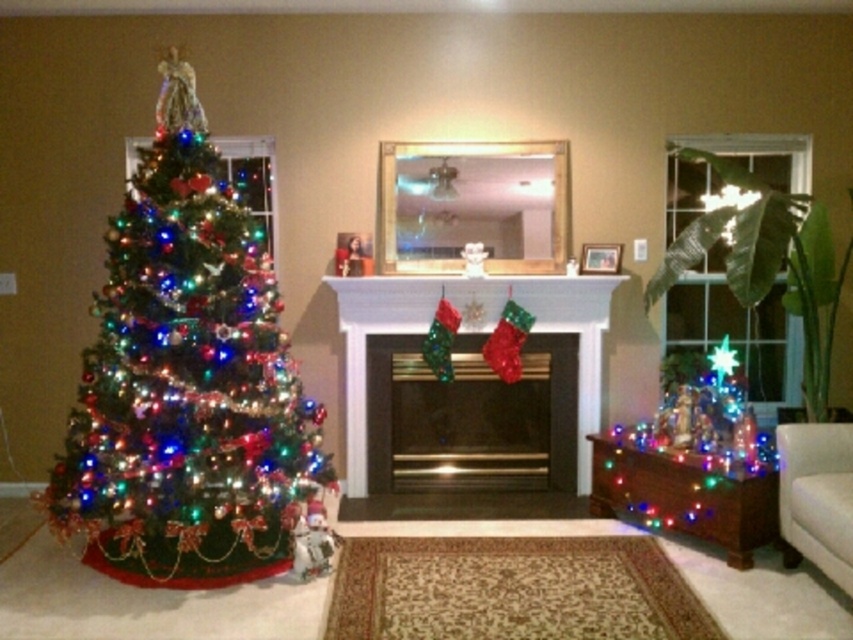
Does white glossy fireplace at center appear on the right side of green leafy plant at right?

Incorrect, white glossy fireplace at center is not on the right side of green leafy plant at right.

Does white glossy fireplace at center have a lesser width compared to green leafy plant at right?

Incorrect, white glossy fireplace at center's width is not less than green leafy plant at right's.

Who is more distant from viewer, [389,305] or [821,413]?

Positioned behind is point [389,305].

Find the location of `white glossy fireplace at center`. white glossy fireplace at center is located at coordinates (469, 333).

Is shiny green christmas tree at left bigger than metallic gold fireplace at center?

Indeed, shiny green christmas tree at left has a larger size compared to metallic gold fireplace at center.

Does shiny green christmas tree at left appear on the right side of metallic gold fireplace at center?

In fact, shiny green christmas tree at left is to the left of metallic gold fireplace at center.

Between point (283, 426) and point (479, 401), which one is positioned in front?

Positioned in front is point (283, 426).

The width and height of the screenshot is (853, 640). Find the location of `shiny green christmas tree at left`. shiny green christmas tree at left is located at coordinates (186, 381).

Is metallic gold fireplace at center smaller than green leafy plant at right?

Yes.

Can you confirm if metallic gold fireplace at center is taller than green leafy plant at right?

Incorrect, metallic gold fireplace at center's height is not larger of green leafy plant at right's.

Who is more distant from viewer, (461, 419) or (825, 269)?

Point (461, 419)

Locate an element on the screen. metallic gold fireplace at center is located at coordinates (473, 412).